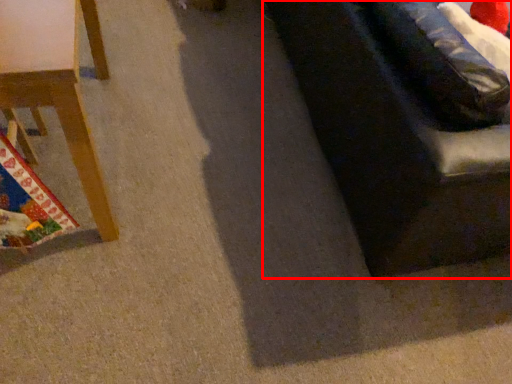
Question: From the image's perspective, where is studio couch (annotated by the red box) located relative to furniture?

Choices:
 (A) below
 (B) above

Answer: (B)